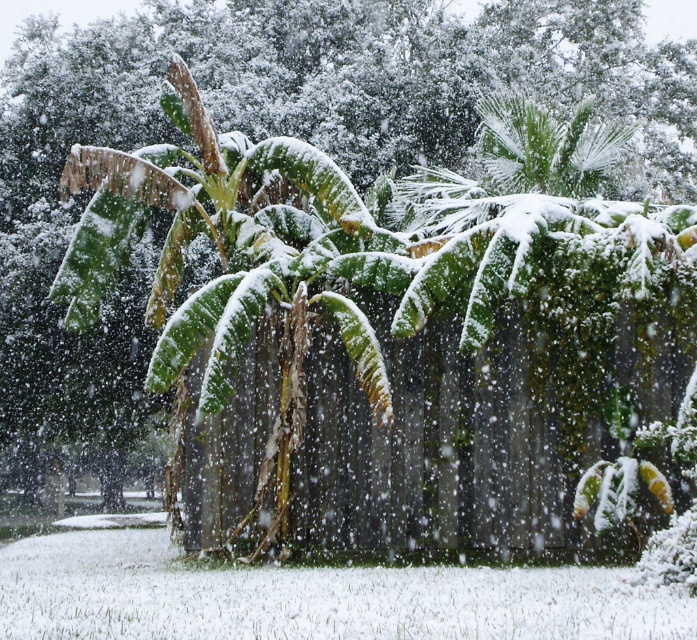
Can you confirm if green wood fence at center is wider than green leafy palm at center?

Yes.

Is point (408, 417) farther from viewer compared to point (236, 304)?

Yes, it is behind point (236, 304).

Locate an element on the screen. green wood fence at center is located at coordinates (431, 429).